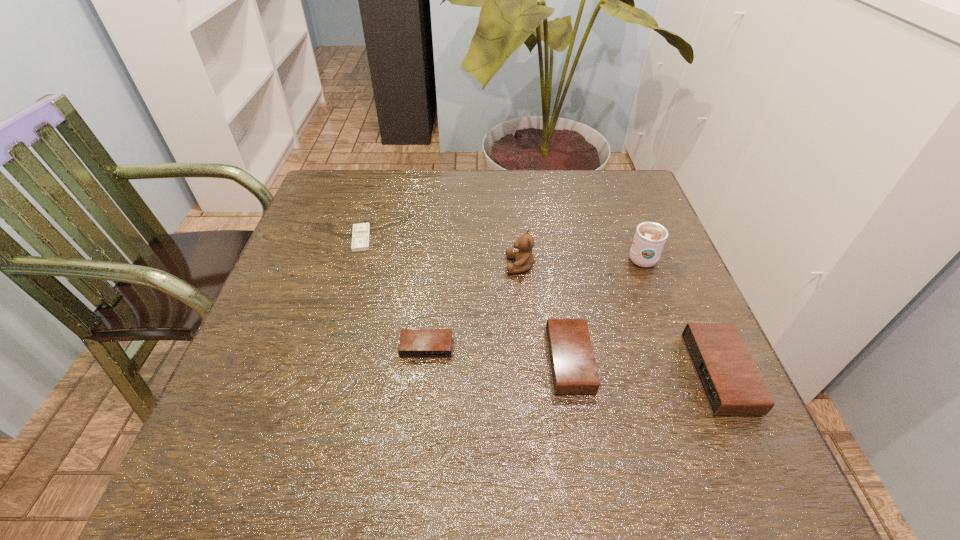
This screenshot has height=540, width=960. Find the location of `vacant space at the near left corner of the desktop`. vacant space at the near left corner of the desktop is located at coordinates (309, 414).

The image size is (960, 540). In order to click on free spot at the far right corner of the desktop in this screenshot , I will do `click(628, 199)`.

Identify the location of free point between the leftmost object and the cup. Image resolution: width=960 pixels, height=540 pixels. (501, 248).

At what (x,y) coordinates should I click in order to perform the action: click on vacant area that lies between the second tallest object and the cup. Please return your answer as a coordinate pair (x, y). Image resolution: width=960 pixels, height=540 pixels. Looking at the image, I should click on (581, 261).

Locate an element on the screen. The image size is (960, 540). vacant area that lies between the teddy bear and the fourth object from left to right is located at coordinates (545, 313).

This screenshot has height=540, width=960. What are the coordinates of `empty location between the second object from left to right and the tallest object` in the screenshot? It's located at (534, 302).

The width and height of the screenshot is (960, 540). I want to click on vacant area that lies between the teddy bear and the rightmost alarm clock, so click(620, 320).

The height and width of the screenshot is (540, 960). In order to click on free space between the fourth object from left to right and the cup in this screenshot , I will do (x=606, y=308).

Where is `empty location between the second shortest alarm clock and the tallest object`? The image size is (960, 540). empty location between the second shortest alarm clock and the tallest object is located at coordinates (606, 308).

The width and height of the screenshot is (960, 540). Identify the location of free area in between the shortest object and the second object from left to right. coord(394,293).